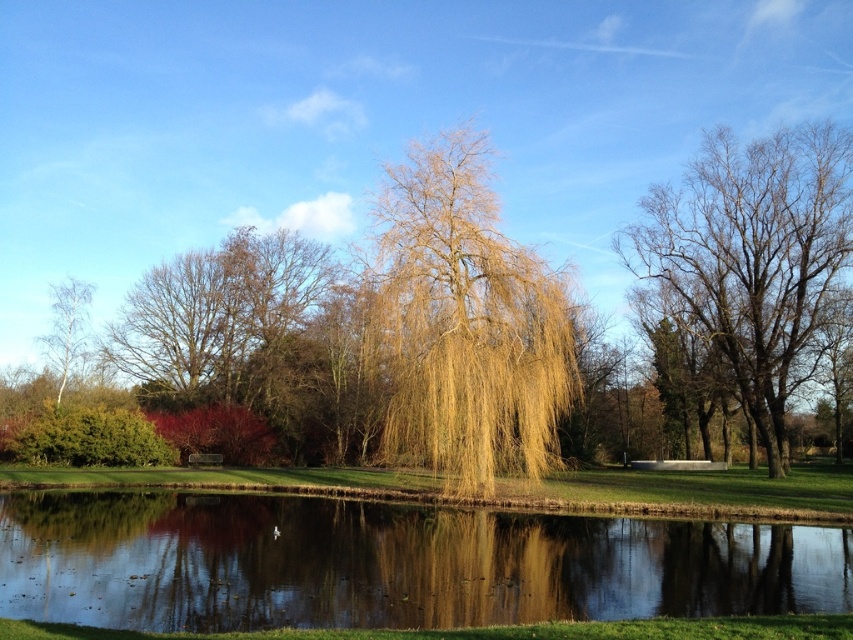
You are standing at the origin point in the scene. Where is the reflective glass water at center located in terms of coordinates?

The reflective glass water at center is located at coordinates point (x=390, y=564).

You are standing at the edge of the pond and notice a point marked at coordinates (390, 564). Based on the scene description, can you determine if this point is located on the reflective glass water at center?

Yes, the point at (390, 564) is on the reflective glass water at center as stated in the description.

Based on the photo, you are standing at the edge of the pond looking towards the weeping willow tree. There are two points marked in the image, one at point (572, 611) and the other at point (6, 468). Which point is closer to you?

Point (572, 611) is closer to the camera than point (6, 468), so the point at (572, 611) is closer to you.